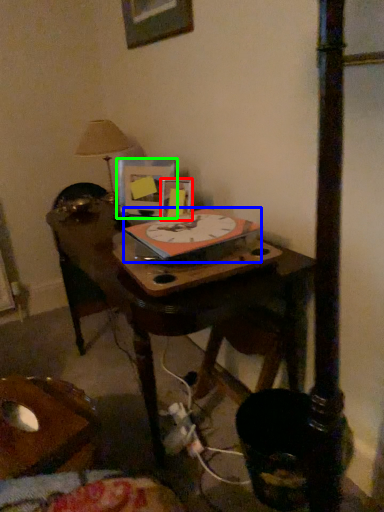
Question: Which object is the closest to the picture frame (highlighted by a red box)? Choose among these: clock (highlighted by a blue box) or picture frame (highlighted by a green box).

Choices:
 (A) clock
 (B) picture frame

Answer: (B)